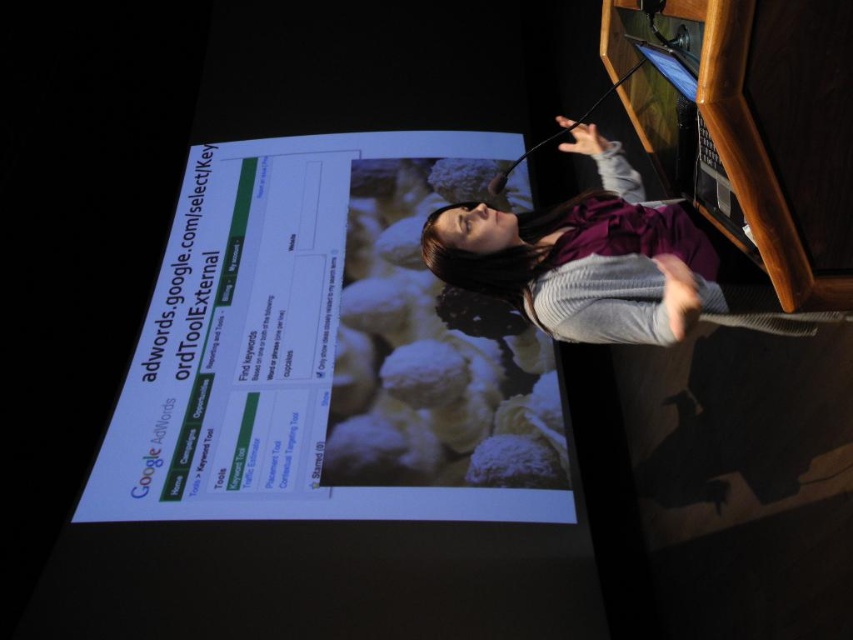
Question: Is white glossy projector screen at center below purple fabric dress at center?

Choices:
 (A) yes
 (B) no

Answer: (A)

Question: Is white glossy projector screen at center above purple fabric dress at center?

Choices:
 (A) yes
 (B) no

Answer: (B)

Question: Among these objects, which one is nearest to the camera?

Choices:
 (A) purple fabric dress at center
 (B) white glossy projector screen at center

Answer: (A)

Question: Can you confirm if white glossy projector screen at center is positioned above purple fabric dress at center?

Choices:
 (A) yes
 (B) no

Answer: (B)

Question: Which point is farther to the camera?

Choices:
 (A) (350, 477)
 (B) (585, 221)

Answer: (A)

Question: Among these objects, which one is farthest from the camera?

Choices:
 (A) white glossy projector screen at center
 (B) purple fabric dress at center

Answer: (A)